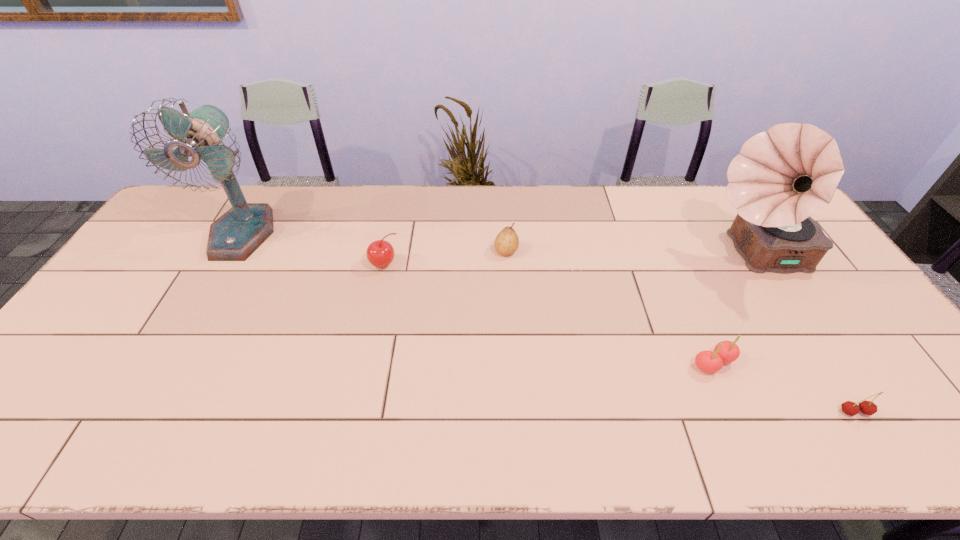
This screenshot has width=960, height=540. In order to click on free space located from the horn of the record player in this screenshot , I will do `click(595, 254)`.

At what (x,y) coordinates should I click in order to perform the action: click on free region located 0.140m from the horn of the record player. Please return your answer as a coordinate pair (x, y). The height and width of the screenshot is (540, 960). Looking at the image, I should click on (657, 254).

Identify the location of free space located from the horn of the record player. Image resolution: width=960 pixels, height=540 pixels. (657, 254).

Image resolution: width=960 pixels, height=540 pixels. Identify the location of vacant space located 0.370m on the right of the pear. (636, 251).

I want to click on blank area located on the right of the leftmost cherry, so click(x=494, y=265).

Where is `blank area located on the back of the second nearest object`? blank area located on the back of the second nearest object is located at coordinates (674, 272).

At what (x,y) coordinates should I click in order to perform the action: click on vacant area situated 0.050m on the surface of the nearest cherry. Please return your answer as a coordinate pair (x, y). This screenshot has height=540, width=960. Looking at the image, I should click on (873, 441).

Find the location of a particular element. Image resolution: width=960 pixels, height=540 pixels. fan at the far edge is located at coordinates (234, 236).

Locate an element on the screen. This screenshot has width=960, height=540. record player located at the far edge is located at coordinates (781, 177).

I want to click on object located at the near edge, so click(849, 408).